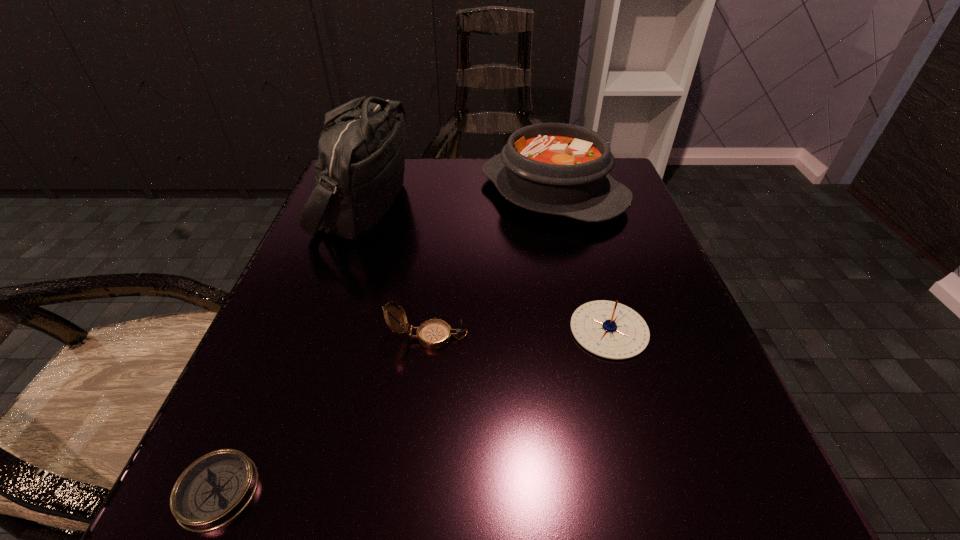
Identify the location of object that is at the far right corner. The height and width of the screenshot is (540, 960). (562, 169).

The width and height of the screenshot is (960, 540). Find the location of `blank area at the far edge`. blank area at the far edge is located at coordinates (436, 206).

Identify the location of free space at the near edge. This screenshot has height=540, width=960. (495, 530).

At what (x,y) coordinates should I click in order to perform the action: click on vacant space at the left edge of the desktop. Please return your answer as a coordinate pair (x, y). Looking at the image, I should click on (283, 314).

Identify the location of free region at the right edge of the desktop. The image size is (960, 540). (614, 235).

Where is `vacant area at the far left corner`? The width and height of the screenshot is (960, 540). vacant area at the far left corner is located at coordinates (408, 157).

You are a GUI agent. You are given a task and a screenshot of the screen. Output one action in this format:
    pyautogui.click(x=<x>, y=<y>)
    Task: Click on the free space between the tallest object and the fourth shortest object
    The image size is (960, 540).
    Given the screenshot: What is the action you would take?
    pyautogui.click(x=458, y=199)

Locate an element on the screen. The width and height of the screenshot is (960, 540). empty space between the nearest compass and the rightmost compass is located at coordinates (414, 410).

Where is `vacant space that is in between the rightmost compass and the tallest object`? vacant space that is in between the rightmost compass and the tallest object is located at coordinates (487, 267).

Locate an element on the screen. free space between the third object from left to right and the shortest object is located at coordinates (323, 414).